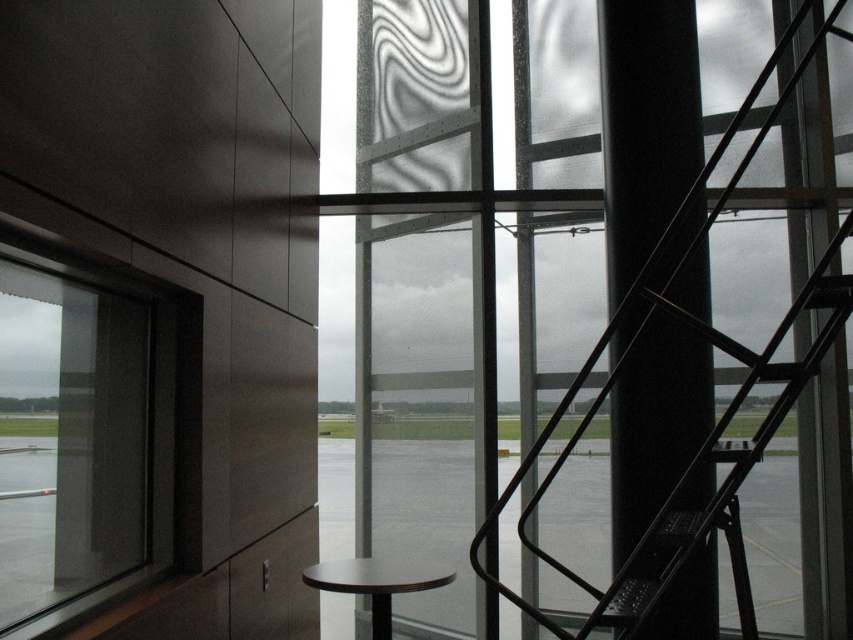
Question: Is smooth asphalt tarmac at center to the left of matte black stool at lower center from the viewer's perspective?

Choices:
 (A) no
 (B) yes

Answer: (B)

Question: Can you confirm if metallic black ladder at right is positioned above matte black stool at lower center?

Choices:
 (A) yes
 (B) no

Answer: (A)

Question: Which object is the closest to the smooth asphalt tarmac at center?

Choices:
 (A) transparent glass window at left
 (B) metallic black ladder at right
 (C) matte black stool at lower center

Answer: (C)

Question: Which object is farther from the camera taking this photo?

Choices:
 (A) metallic black ladder at right
 (B) matte black stool at lower center
 (C) smooth asphalt tarmac at center

Answer: (C)

Question: Does metallic black ladder at right appear on the left side of matte black stool at lower center?

Choices:
 (A) yes
 (B) no

Answer: (B)

Question: Which of the following is the closest to the observer?

Choices:
 (A) (322, 636)
 (B) (631, 102)
 (C) (341, 568)
 (D) (125, 515)

Answer: (D)